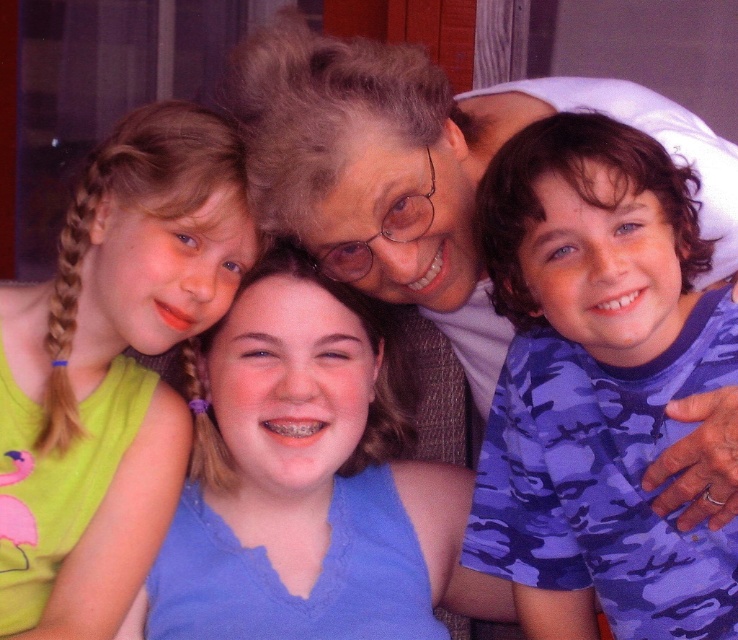
Which is in front, point (703, 305) or point (120, 611)?

Point (703, 305) is in front.

Does point (630, 509) lie behind point (184, 124)?

No, it is in front of (184, 124).

Find the location of `camouflage shirt at right`. camouflage shirt at right is located at coordinates (596, 385).

Looking at this image, does matte black glasses at center appear under green fabric shirt at left?

No, matte black glasses at center is not below green fabric shirt at left.

Is point (277, 202) positioned in front of point (210, 252)?

Yes, it is in front of point (210, 252).

Find the location of a particular element. This screenshot has width=738, height=640. matte black glasses at center is located at coordinates (421, 170).

Between camouflage shirt at right and matte black glasses at center, which one appears on the left side from the viewer's perspective?

Positioned to the left is matte black glasses at center.

Identify the location of camouflage shirt at right. pyautogui.click(x=596, y=385).

Describe the element at coordinates (596, 385) in the screenshot. I see `camouflage shirt at right` at that location.

At what (x,y) coordinates should I click in order to perform the action: click on camouflage shirt at right. Please return your answer as a coordinate pair (x, y). This screenshot has width=738, height=640. Looking at the image, I should click on (596, 385).